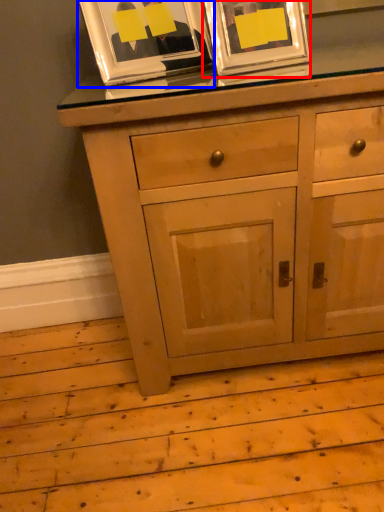
Question: Which point is closer to the camera, picture frame (highlighted by a red box) or picture frame (highlighted by a blue box)?

Choices:
 (A) picture frame
 (B) picture frame

Answer: (A)